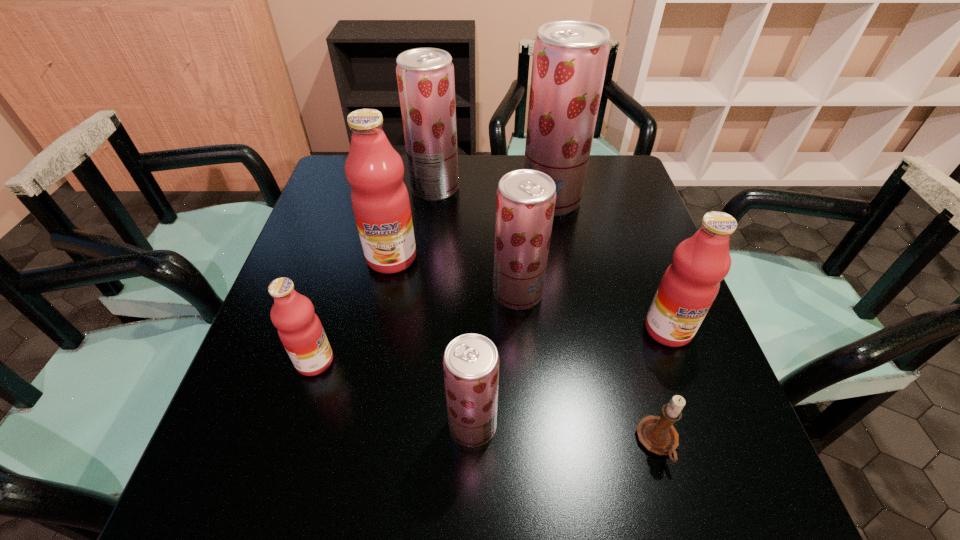
In order to click on free spot that satisfies the following two spatial constraints: 1. on the label of the biggest pink fruit juice; 2. on the left side of the third farthest strawberry fruit juice in this screenshot , I will do `click(384, 293)`.